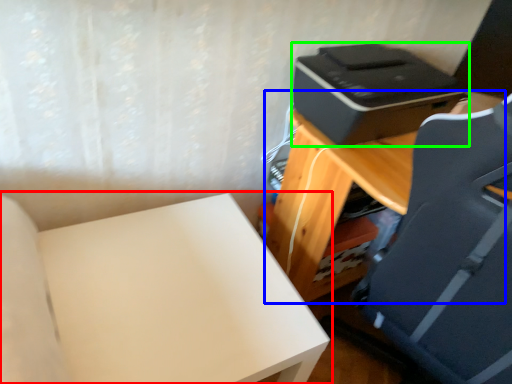
Question: Based on their relative distances, which object is nearer to furniture (highlighted by a red box)? Choose from table (highlighted by a blue box) and printer (highlighted by a green box).

Choices:
 (A) table
 (B) printer

Answer: (A)